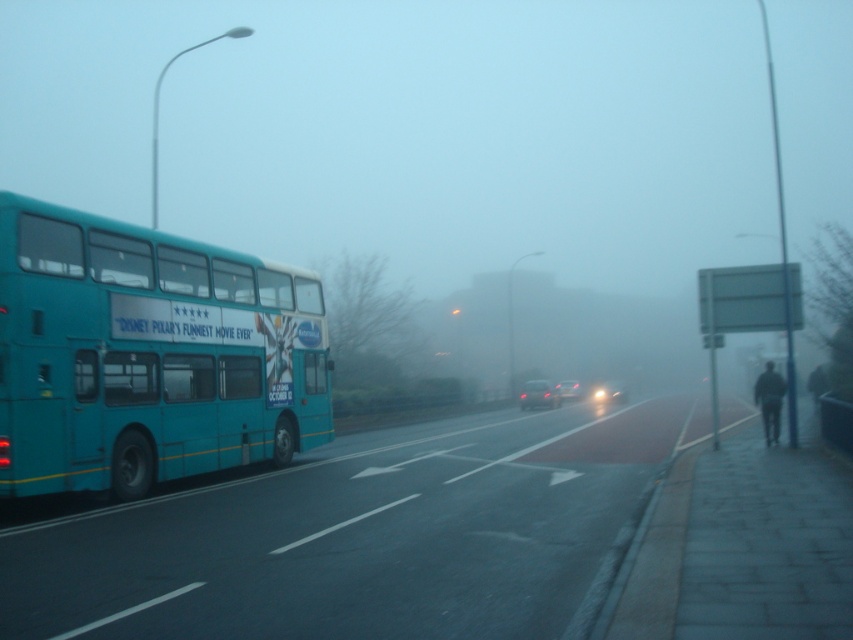
Question: Which point appears closest to the camera in this image?

Choices:
 (A) (68, 339)
 (B) (715, 426)

Answer: (A)

Question: Can you confirm if teal matte/deckbus at left is bigger than white signboard at right?

Choices:
 (A) no
 (B) yes

Answer: (A)

Question: Does teal matte/deckbus at left lie behind white signboard at right?

Choices:
 (A) no
 (B) yes

Answer: (A)

Question: Can you confirm if teal matte/deckbus at left is thinner than white signboard at right?

Choices:
 (A) yes
 (B) no

Answer: (A)